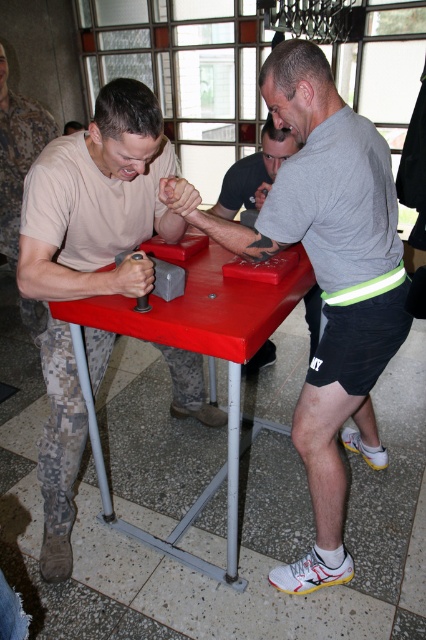
Consider the image. You are a photographer standing at a certain distance from the gray matte shirt at center. If you want to take a closeup photo of the shirt, would you need to move closer or farther away?

The gray matte shirt at center is 4.23 feet away from the camera. To take a closeup photo, you would need to move closer to reduce the distance between the camera and the shirt.